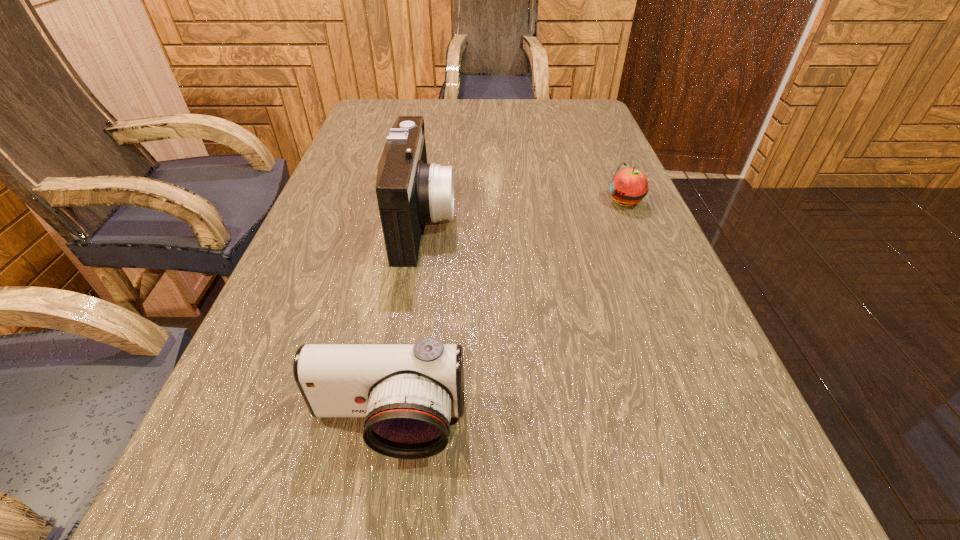
Where is `the taller camcorder`? The height and width of the screenshot is (540, 960). the taller camcorder is located at coordinates (410, 192).

Find the location of a particular element. Image resolution: width=960 pixels, height=540 pixels. the farther camcorder is located at coordinates (410, 192).

What are the coordinates of `the nearest object` in the screenshot? It's located at (407, 393).

Image resolution: width=960 pixels, height=540 pixels. In order to click on the shorter camcorder in this screenshot , I will do `click(407, 393)`.

This screenshot has width=960, height=540. In order to click on apple in this screenshot , I will do `click(629, 186)`.

At what (x,y) coordinates should I click in order to perform the action: click on the shortest object. Please return your answer as a coordinate pair (x, y). The width and height of the screenshot is (960, 540). Looking at the image, I should click on (629, 186).

At what (x,y) coordinates should I click in order to perform the action: click on free point located 0.130m on the lens of the tallest object. Please return your answer as a coordinate pair (x, y). The image size is (960, 540). Looking at the image, I should click on (514, 221).

At what (x,y) coordinates should I click in order to perform the action: click on free space located 0.070m on the surface of the second tallest object. Please return your answer as a coordinate pair (x, y). Looking at the image, I should click on (372, 523).

This screenshot has width=960, height=540. I want to click on vacant region located on the front of the apple, so click(688, 348).

You are a GUI agent. You are given a task and a screenshot of the screen. Output one action in this format:
    pyautogui.click(x=<x>, y=<y>)
    Task: Click on the object at the left edge
    
    Given the screenshot: What is the action you would take?
    pyautogui.click(x=407, y=393)